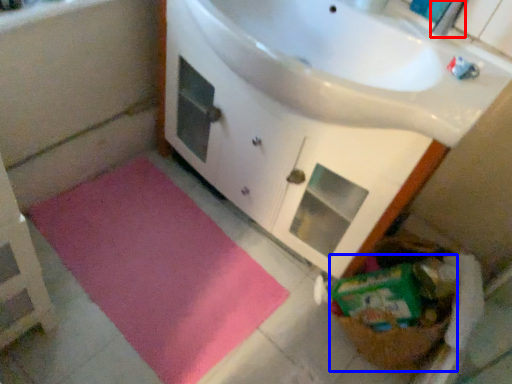
Question: Which object appears closest to the camera in this image, faucet (highlighted by a red box) or basket (highlighted by a blue box)?

Choices:
 (A) faucet
 (B) basket

Answer: (A)